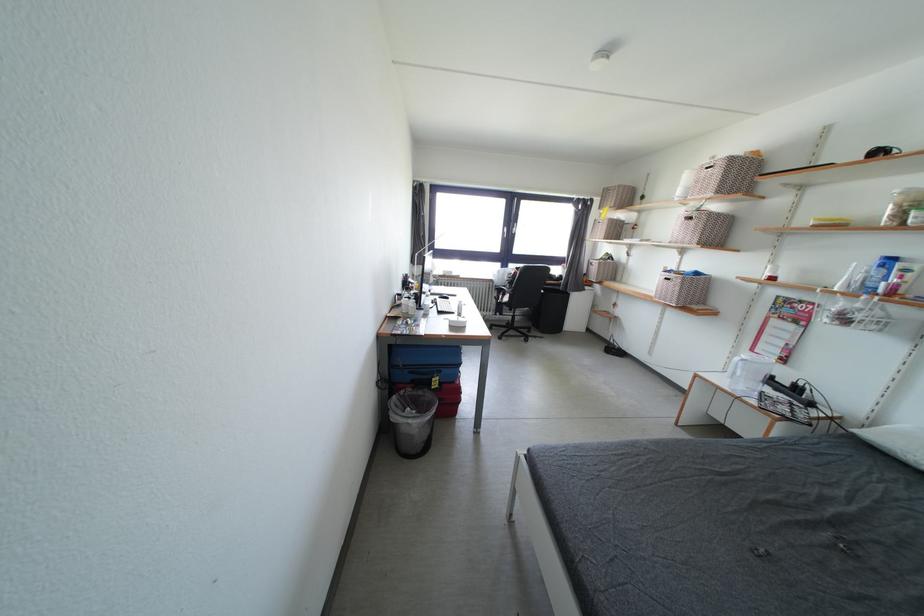
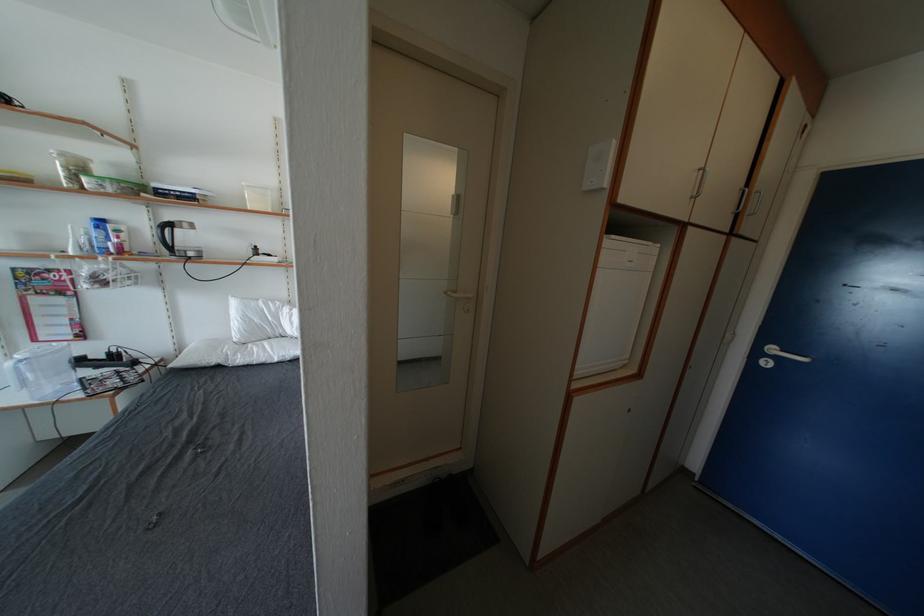
Find the pixel in the second image that matches the point at 801,389 in the first image.

(116, 359)